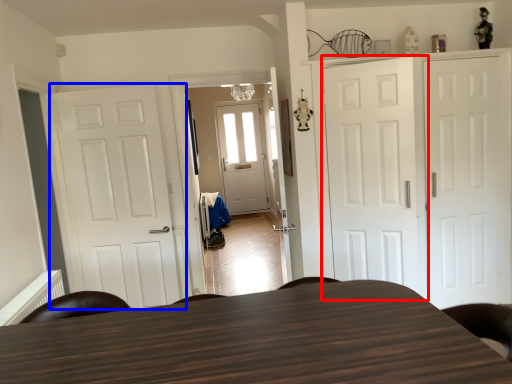
Question: Which point is closer to the camera, door (highlighted by a red box) or door (highlighted by a blue box)?

Choices:
 (A) door
 (B) door

Answer: (A)